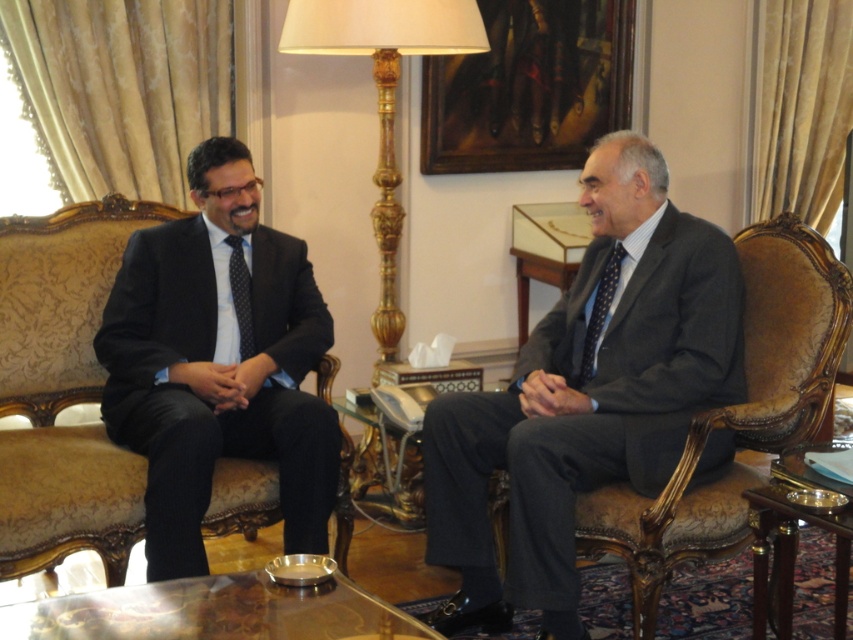
Question: Observing the image, what is the correct spatial positioning of dark blue textured tie at right in reference to polka dot silk tie at left?

Choices:
 (A) below
 (B) above

Answer: (A)

Question: Does gold polished wood floor lamp at center have a larger size compared to dark blue textured tie at right?

Choices:
 (A) yes
 (B) no

Answer: (A)

Question: Which of the following is the closest to the observer?

Choices:
 (A) (604, 412)
 (B) (425, 8)

Answer: (A)

Question: Is dark gray textured suit at right above polka dot silk tie at left?

Choices:
 (A) yes
 (B) no

Answer: (B)

Question: Which object appears closest to the camera in this image?

Choices:
 (A) matte black suit at left
 (B) dark blue textured tie at right
 (C) polka dot silk tie at left

Answer: (A)

Question: Which object is closer to the camera taking this photo?

Choices:
 (A) dark gray textured suit at right
 (B) matte black suit at left
 (C) dark blue textured tie at right
 (D) polka dot silk tie at left

Answer: (A)